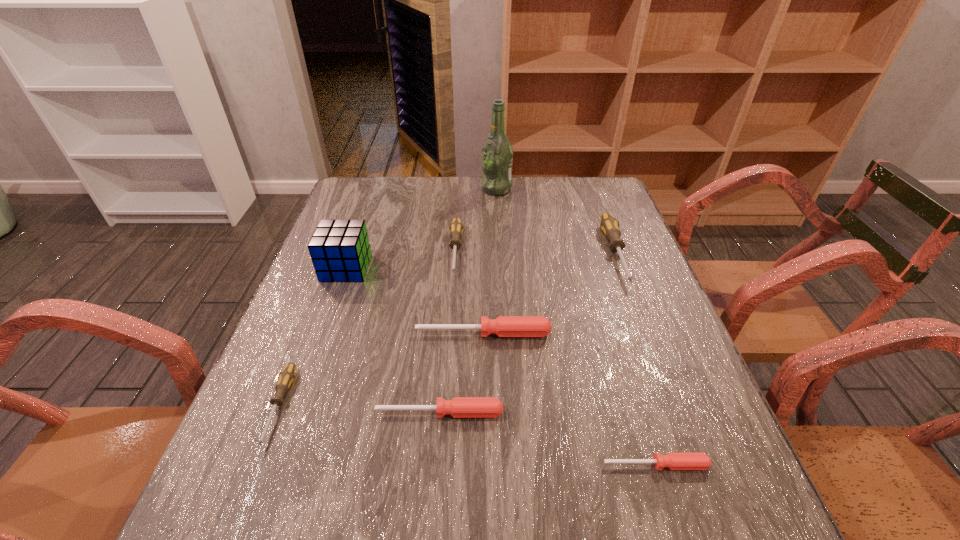
Locate an element on the screen. The width and height of the screenshot is (960, 540). free space located on the right of the biggest red screwdriver is located at coordinates (599, 333).

I want to click on free space located on the right of the second farthest red screwdriver, so click(x=609, y=413).

At what (x,y) coordinates should I click in order to perform the action: click on blank area located 0.080m at the tip of the nearest gray screwdriver. Please return your answer as a coordinate pair (x, y). Image resolution: width=960 pixels, height=540 pixels. Looking at the image, I should click on (244, 498).

Where is `vacant space located on the left of the nearest object`? Image resolution: width=960 pixels, height=540 pixels. vacant space located on the left of the nearest object is located at coordinates (475, 465).

Locate an element on the screen. object located in the far edge section of the desktop is located at coordinates (497, 153).

This screenshot has width=960, height=540. Identify the location of cube at the left edge. point(340,250).

The image size is (960, 540). I want to click on screwdriver that is at the left edge, so click(286, 377).

At what (x,y) coordinates should I click in order to perform the action: click on vacant space at the far edge of the desktop. Please return your answer as a coordinate pair (x, y). Looking at the image, I should click on (426, 181).

The height and width of the screenshot is (540, 960). What are the coordinates of `free point at the near edge` in the screenshot? It's located at coord(492,538).

In order to click on vacant space at the left edge in this screenshot , I will do `click(380, 238)`.